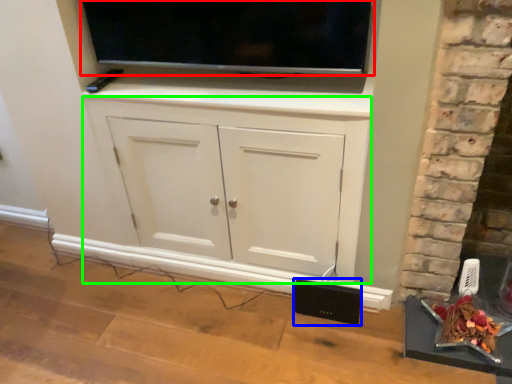
Question: Considering the real-world distances, which object is farthest from television (highlighted by a red box)? speaker (highlighted by a blue box) or cabinetry (highlighted by a green box)?

Choices:
 (A) speaker
 (B) cabinetry

Answer: (A)